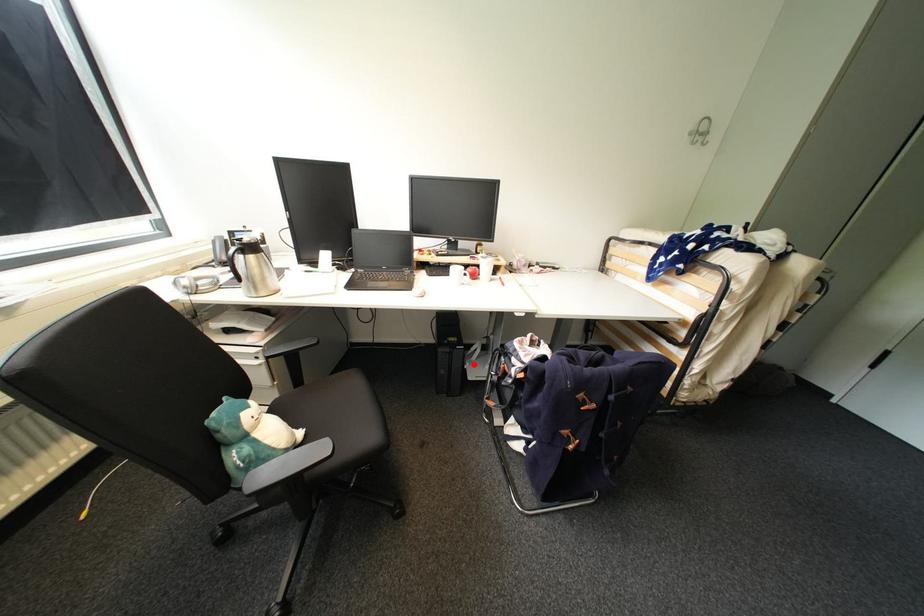
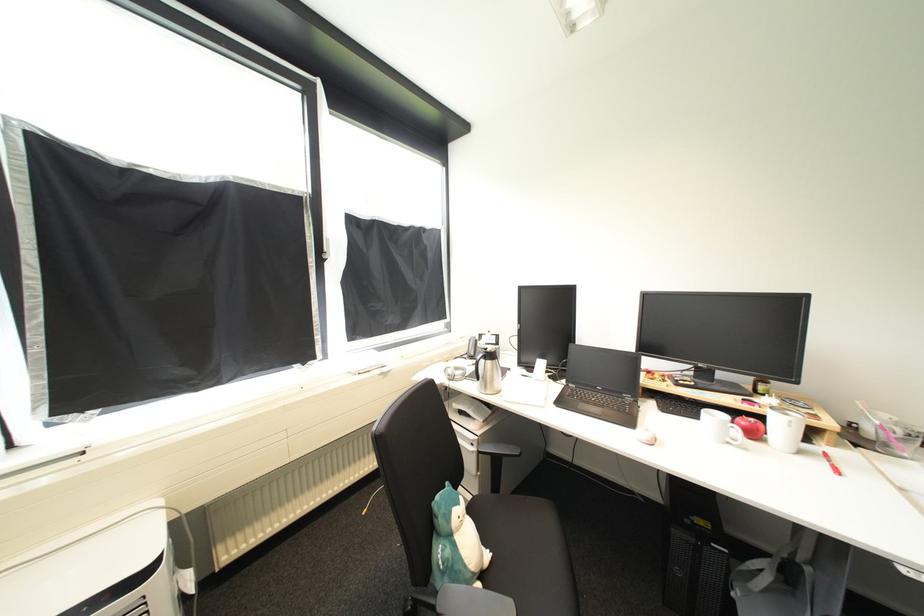
The point at the highlighted location is marked in the first image. Where is the corresponding point in the second image?

(745, 591)